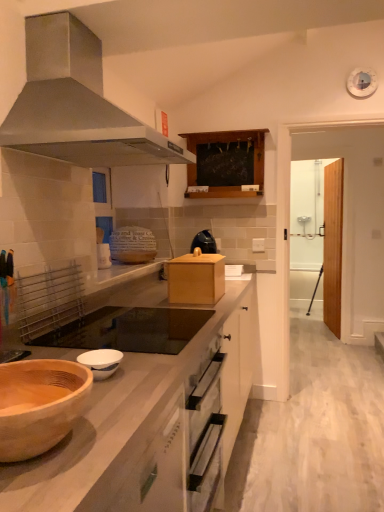
Question: Looking at the image, does wooden cabinet at upper center seem bigger or smaller compared to transparent glass door at right, the first glass door viewed from the left?

Choices:
 (A) small
 (B) big

Answer: (A)

Question: Is wooden cabinet at upper center to the left or to the right of transparent glass door at right, the 2th glass door viewed from the right, in the image?

Choices:
 (A) left
 (B) right

Answer: (A)

Question: Which object is positioned closest to the wooden at left?

Choices:
 (A) transparent glass door at right, the 2th glass door positioned from the left
 (B) wooden cabinet at upper center
 (C) wooden bowl at lower left, arranged as the second bowl when viewed from the back
 (D) transparent glass door at right, the first glass door viewed from the left
 (E) white glossy bowl at center, the 2th bowl when ordered from front to back

Answer: (C)

Question: Which object is the farthest from the transparent glass door at right, the 2th glass door positioned from the left?

Choices:
 (A) metallic stainless steel range hood at upper left
 (B) wooden cabinet at upper center
 (C) white glossy bowl at center, the 2th bowl when ordered from front to back
 (D) transparent glass door at right, the 2th glass door viewed from the right
 (E) black glass gas stove at center

Answer: (C)